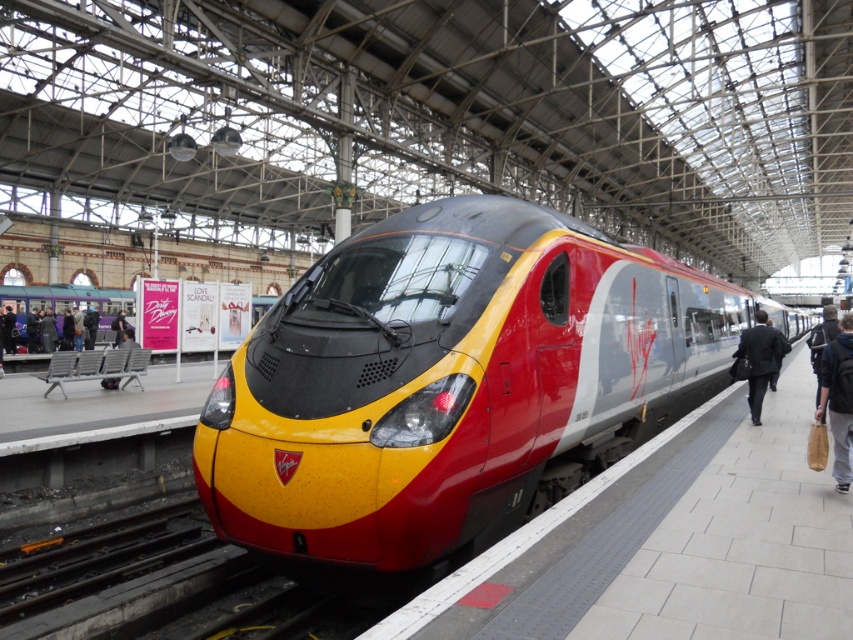
Question: Is metallic red train at center to the right of dark purple clothing at left from the viewer's perspective?

Choices:
 (A) no
 (B) yes

Answer: (B)

Question: Considering the real-world distances, which object is closest to the dark brown leather jacket at left?

Choices:
 (A) dark suit at right
 (B) dark purple clothing at left

Answer: (B)

Question: Does dark purple clothing at left have a lesser width compared to dark brown leather jacket at left?

Choices:
 (A) no
 (B) yes

Answer: (A)

Question: Which of these objects is positioned closest to the dark suit at right?

Choices:
 (A) brown leather bag at right
 (B) dark brown leather jacket at left
 (C) metallic red train at center
 (D) dark purple clothing at left

Answer: (A)

Question: Which is farther from the dark purple clothing at left?

Choices:
 (A) brown leather bag at right
 (B) dark suit at right

Answer: (A)

Question: Is metallic red train at center above dark brown leather jacket at left?

Choices:
 (A) no
 (B) yes

Answer: (A)